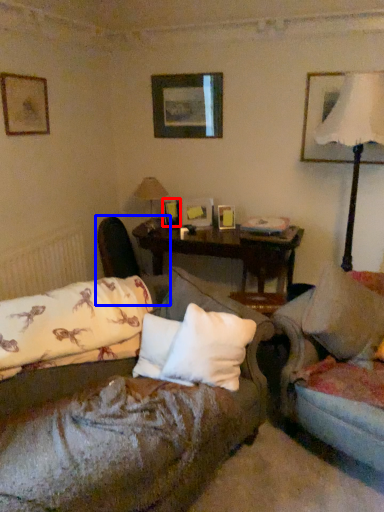
Question: Which object is closer to the camera taking this photo, picture frame (highlighted by a red box) or swivel chair (highlighted by a blue box)?

Choices:
 (A) picture frame
 (B) swivel chair

Answer: (B)